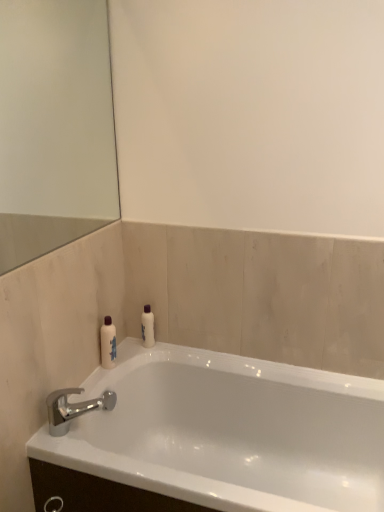
At what (x,y) coordinates should I click in order to perform the action: click on free location in front of chrome metallic faucet at lower left. Please return your answer as a coordinate pair (x, y). The width and height of the screenshot is (384, 512). Looking at the image, I should click on (72, 451).